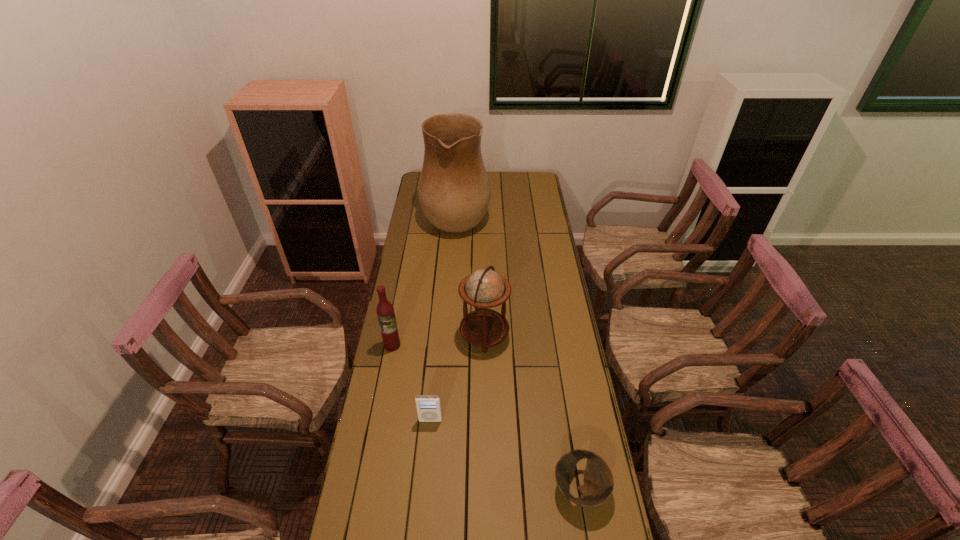
At what (x,y) coordinates should I click in order to perform the action: click on free space between the nearest object and the leftmost object. Please return your answer as a coordinate pair (x, y). The height and width of the screenshot is (540, 960). Looking at the image, I should click on (486, 417).

Locate an element on the screen. The height and width of the screenshot is (540, 960). unoccupied area between the farthest object and the leftmost object is located at coordinates (424, 280).

You are a GUI agent. You are given a task and a screenshot of the screen. Output one action in this format:
    pyautogui.click(x=<x>, y=<y>)
    Task: Click on the unoccupied area between the leftmost object and the iPod
    The width and height of the screenshot is (960, 540).
    Given the screenshot: What is the action you would take?
    pyautogui.click(x=411, y=383)

You are a GUI agent. You are given a task and a screenshot of the screen. Output one action in this format:
    pyautogui.click(x=<x>, y=<y>)
    Task: Click on the object that can be found as the fourth closest to the second nearest object
    
    Given the screenshot: What is the action you would take?
    pyautogui.click(x=454, y=192)

I want to click on object that is the fourth closest to the globe, so click(x=454, y=192).

Identify the location of vacant space that satisfies the following two spatial constraints: 1. on the surface of the globe; 2. on the label of the leftmost object. The image size is (960, 540). (485, 345).

I want to click on vacant space that satisfies the following two spatial constraints: 1. at the spout of the tallest object; 2. on the right side of the rightmost object, so click(437, 489).

You are a GUI agent. You are given a task and a screenshot of the screen. Output one action in this format:
    pyautogui.click(x=<x>, y=<y>)
    Task: Click on the vacant space that satisfies the following two spatial constraints: 1. at the spout of the farthest object; 2. on the back side of the rightmost object
    The image size is (960, 540).
    Given the screenshot: What is the action you would take?
    pyautogui.click(x=437, y=489)

Where is `free space that satisfies the following two spatial constraints: 1. on the surface of the globe; 2. on the front-facing side of the iPod`? This screenshot has width=960, height=540. free space that satisfies the following two spatial constraints: 1. on the surface of the globe; 2. on the front-facing side of the iPod is located at coordinates (485, 420).

Locate an element on the screen. Image resolution: width=960 pixels, height=540 pixels. free spot that satisfies the following two spatial constraints: 1. at the spout of the rightmost object; 2. on the right side of the cream pitcher is located at coordinates (437, 489).